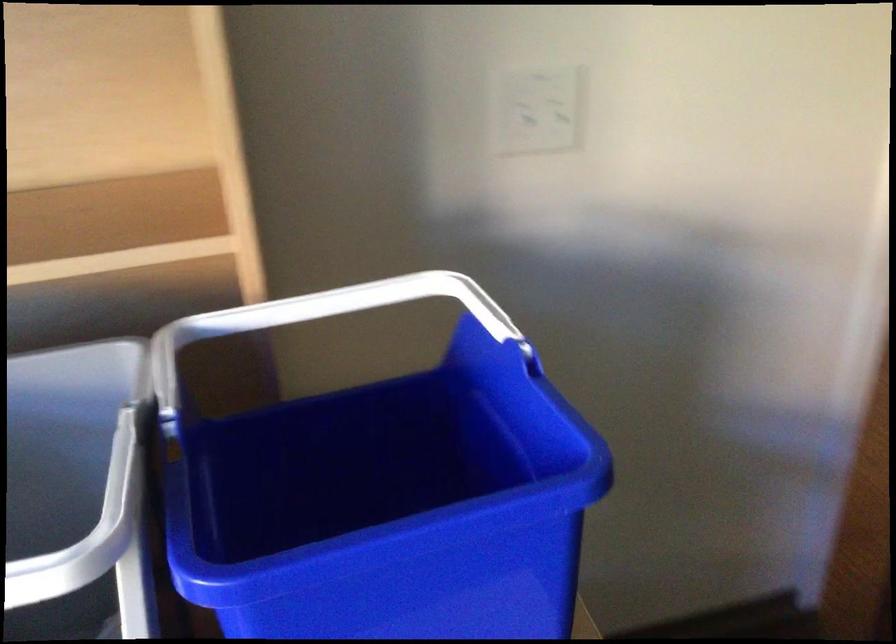
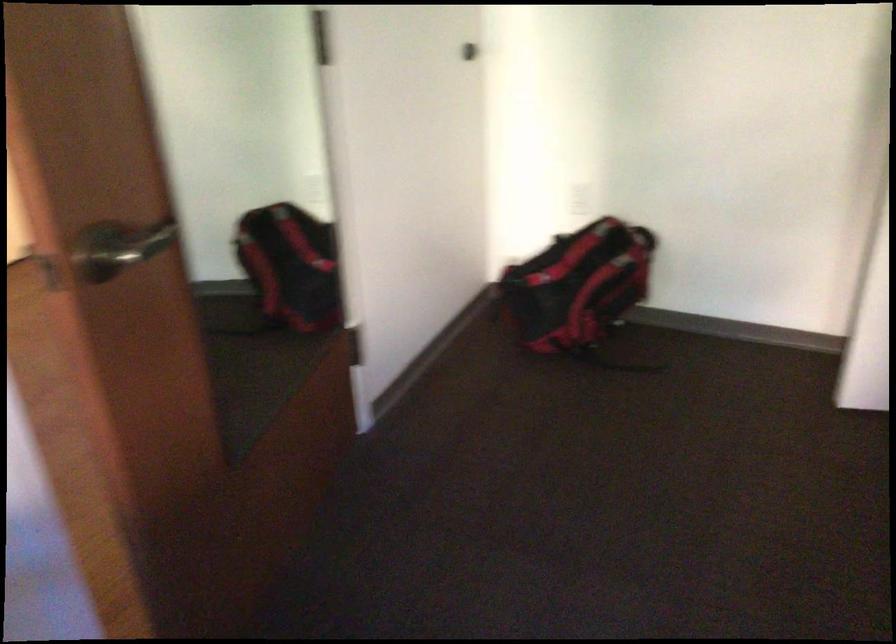
Question: Based on the continuous images, in which direction is the camera rotating? Reply with the corresponding letter.

Choices:
 (A) Left
 (B) Right
 (C) Up
 (D) Down

Answer: (B)